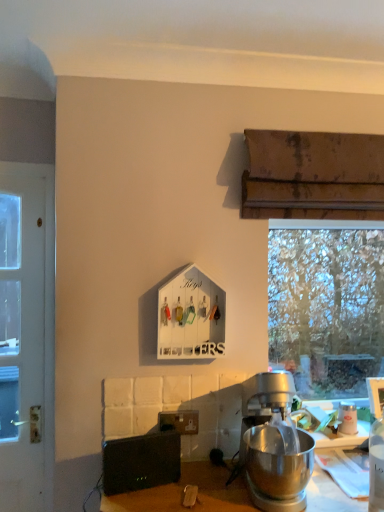
Question: Is the depth of black plastic speaker at lower left less than that of white glossy coffee cup at upper right?

Choices:
 (A) yes
 (B) no

Answer: (A)

Question: Is black plastic speaker at lower left completely or partially outside of white glossy coffee cup at upper right?

Choices:
 (A) no
 (B) yes

Answer: (B)

Question: Is white glossy coffee cup at upper right at the back of black plastic speaker at lower left?

Choices:
 (A) no
 (B) yes

Answer: (A)

Question: Does black plastic speaker at lower left have a larger size compared to white glossy coffee cup at upper right?

Choices:
 (A) no
 (B) yes

Answer: (B)

Question: Is black plastic speaker at lower left at the left side of white glossy coffee cup at upper right?

Choices:
 (A) yes
 (B) no

Answer: (A)

Question: Is black plastic speaker at lower left behind white glossy coffee cup at upper right?

Choices:
 (A) no
 (B) yes

Answer: (A)

Question: Is white painted wood door at left far away from white glossy coffee cup at upper right?

Choices:
 (A) yes
 (B) no

Answer: (A)

Question: Is white painted wood door at left oriented away from white glossy coffee cup at upper right?

Choices:
 (A) yes
 (B) no

Answer: (B)

Question: Is white painted wood door at left oriented towards white glossy coffee cup at upper right?

Choices:
 (A) yes
 (B) no

Answer: (B)

Question: Does white painted wood door at left have a lesser width compared to white glossy coffee cup at upper right?

Choices:
 (A) yes
 (B) no

Answer: (B)

Question: Can you confirm if white painted wood door at left is shorter than white glossy coffee cup at upper right?

Choices:
 (A) yes
 (B) no

Answer: (B)

Question: Considering the relative positions of white painted wood door at left and white glossy coffee cup at upper right in the image provided, is white painted wood door at left to the right of white glossy coffee cup at upper right from the viewer's perspective?

Choices:
 (A) no
 (B) yes

Answer: (A)

Question: Would you say transparent glass window at right is part of white painted wood door at left's contents?

Choices:
 (A) no
 (B) yes

Answer: (A)